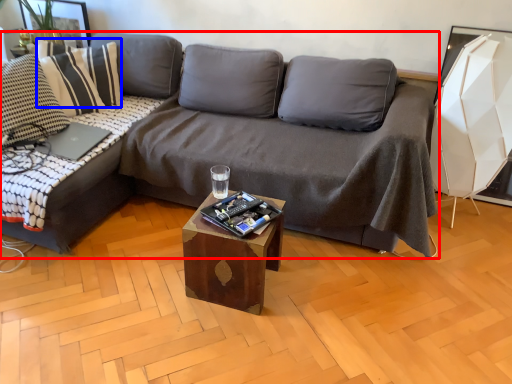
Question: Which point is further to the camera, studio couch (highlighted by a red box) or pillow (highlighted by a blue box)?

Choices:
 (A) studio couch
 (B) pillow

Answer: (B)